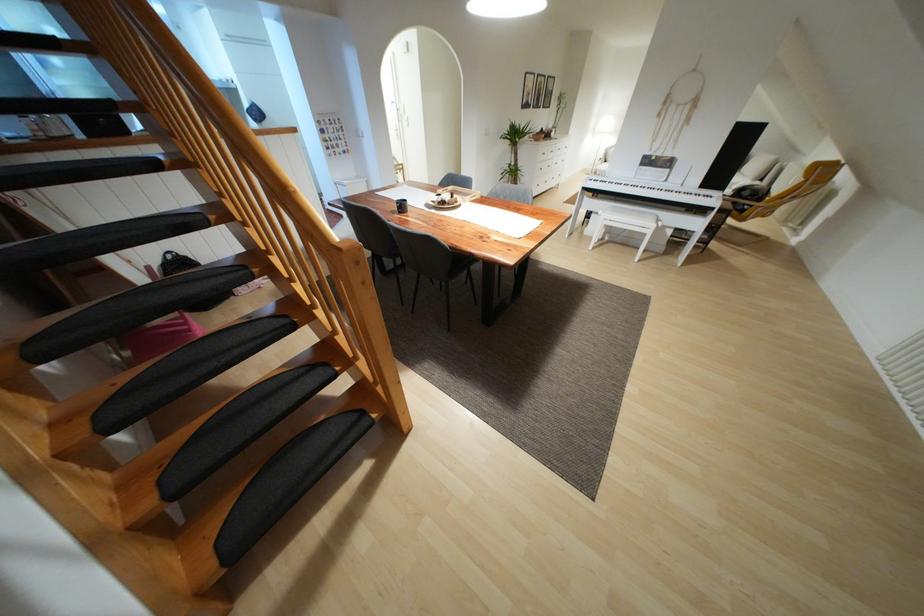
At what (x,y) coordinates should I click in order to perform the action: click on wooden chair armrest. Please return your answer as a coordinate pair (x, y). This screenshot has height=616, width=924. Looking at the image, I should click on (742, 200).